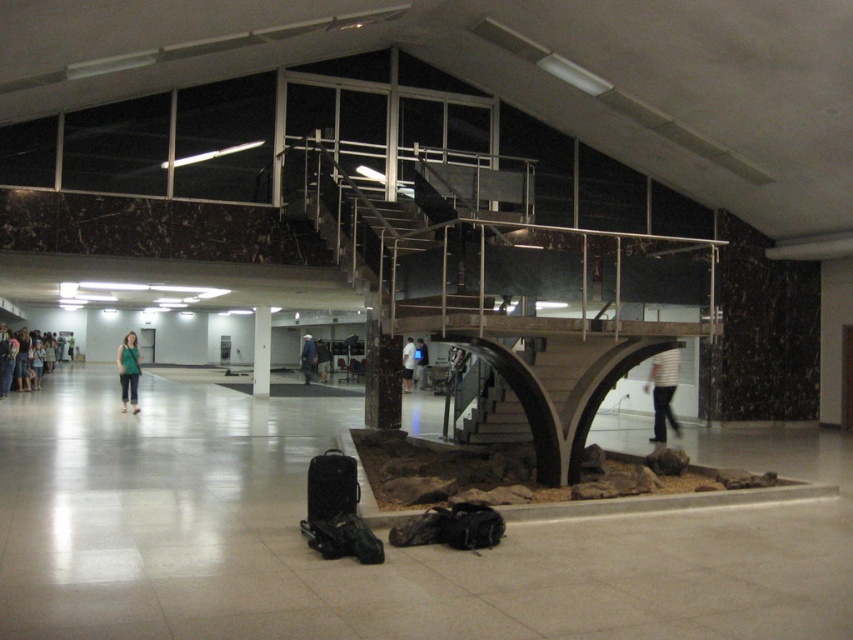
You are standing in the modern indoor space described. You need to determine if the dark brown wooden stairs at center can fit under a standard height doorframe. The white striped shirt at center is 1.8 meters tall. Can the stairs at center pass through the doorframe?

The dark brown wooden stairs at center is not as tall as the white striped shirt at center, which is 1.8 meters tall. Therefore, the stairs are shorter than 1.8 meters and can pass under a standard doorframe.

You are organizing a clothing rack in the image and need to arrange the white shirt at center and the blue denim jacket at center. According to the scene, which clothing item is located to the right of the other?

The white shirt at center is positioned on the right side of the blue denim jacket at center.